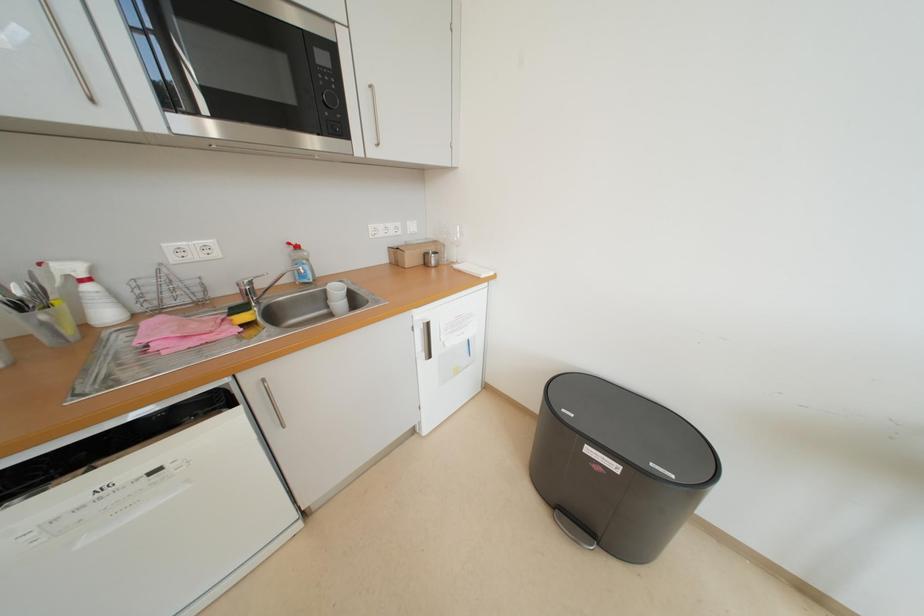
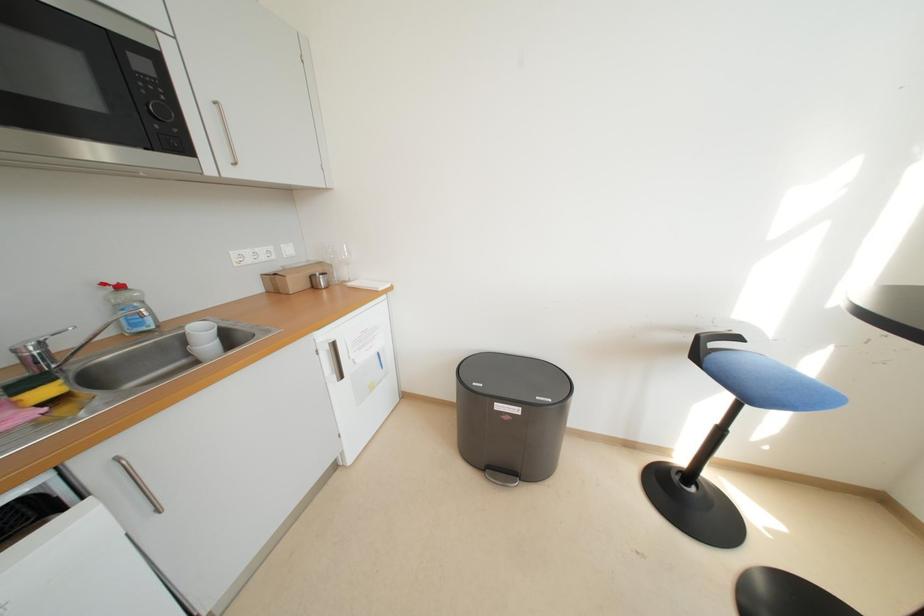
Question: How did the camera likely rotate?

Choices:
 (A) Left
 (B) Right
 (C) Up
 (D) Down

Answer: (B)